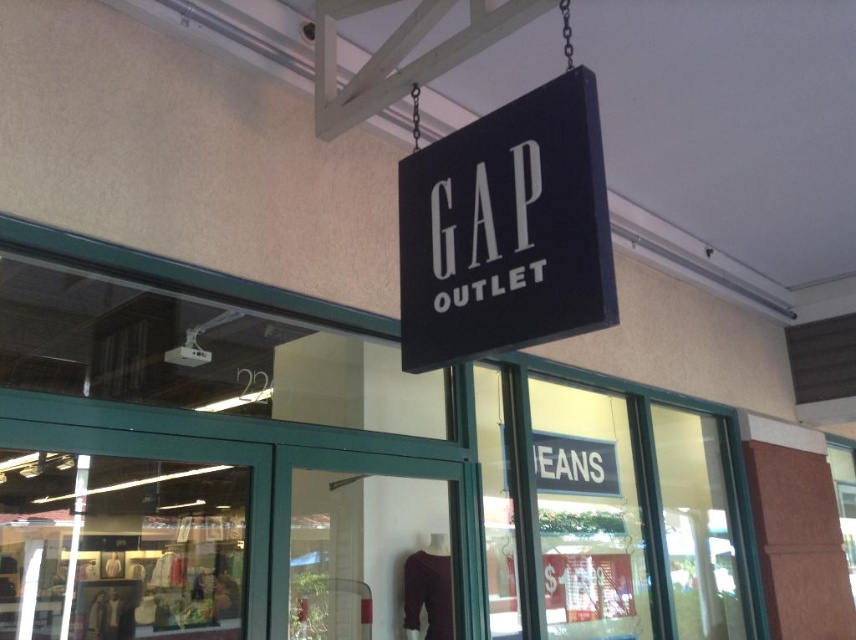
Between black matte sign at center and matte glass door at center, which one is positioned lower?

matte glass door at center is below.

Does black matte sign at center appear on the left side of matte glass door at center?

No, black matte sign at center is not to the left of matte glass door at center.

Which is in front, point (497, 145) or point (360, 476)?

Point (497, 145)

In order to click on black matte sign at center in this screenshot , I will do [506, 228].